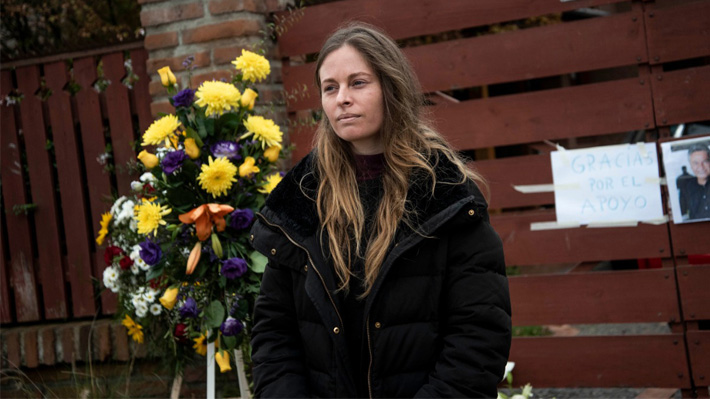
Locate an element on the screen. This screenshot has width=710, height=399. bouquet is located at coordinates (199, 160).